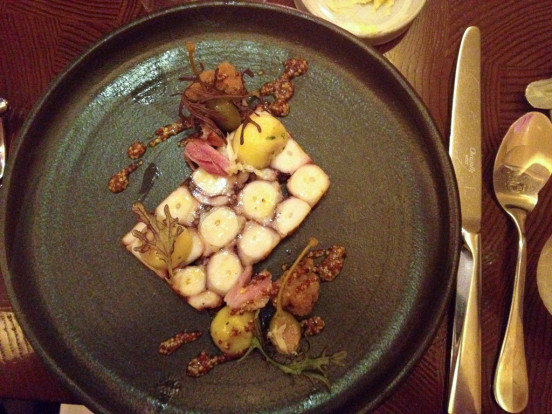
This screenshot has width=552, height=414. I want to click on spoon, so [524, 191].